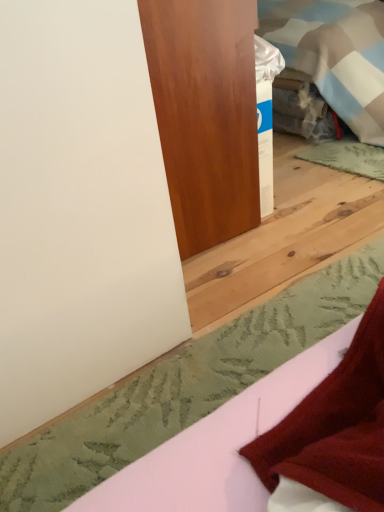
Where is `empty space that is ontop of white matte sheet at lower right (from a real-world perspective)`? empty space that is ontop of white matte sheet at lower right (from a real-world perspective) is located at coordinates (243, 355).